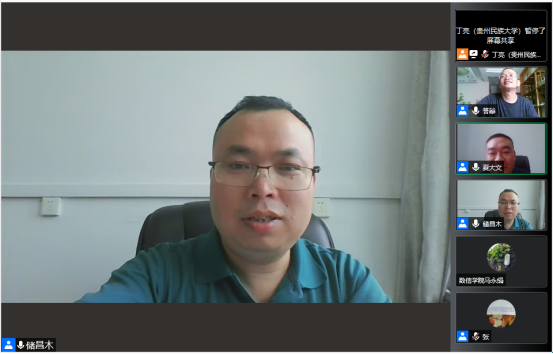
This screenshot has height=354, width=553. What are the coordinates of `bookshelf` in the screenshot? It's located at (541, 82).